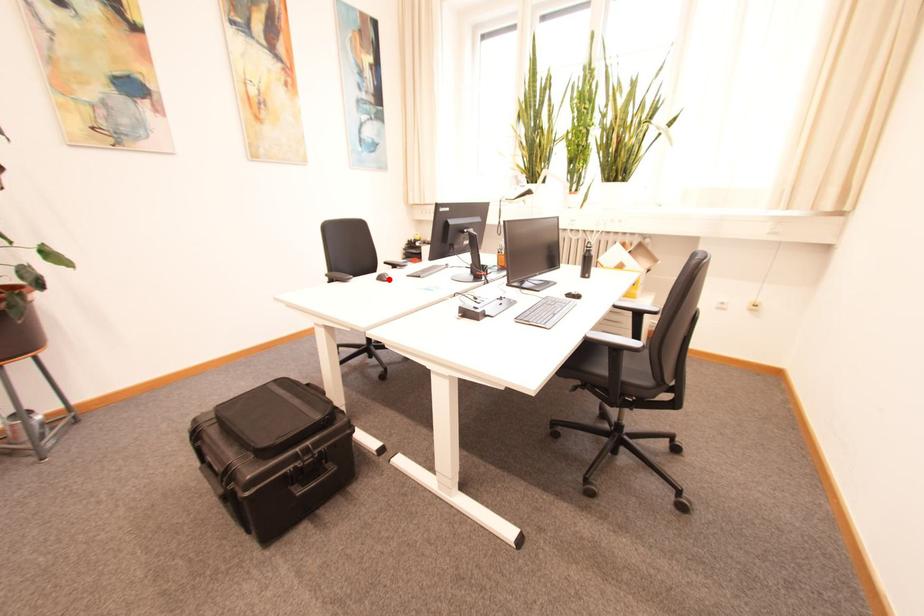
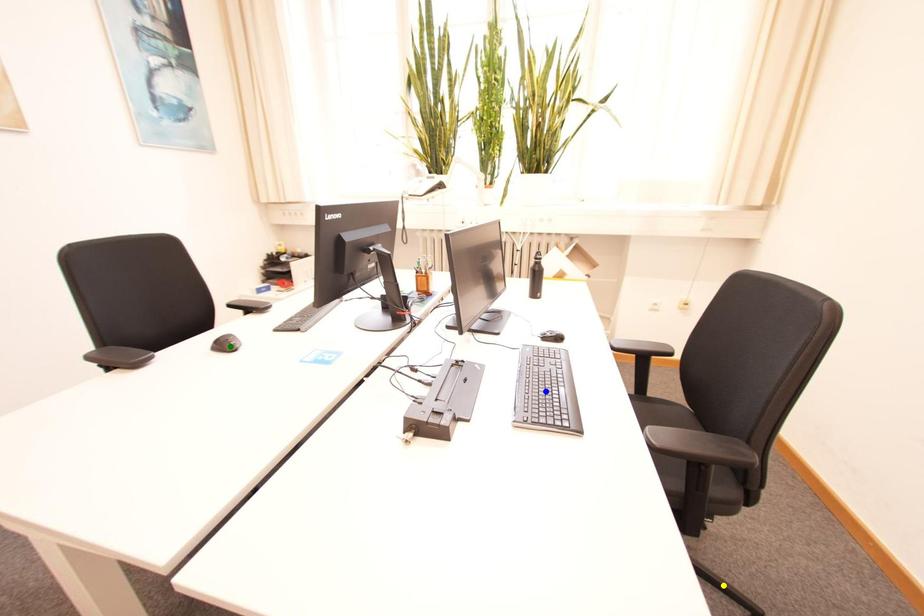
Question: I am providing you with two images of the same scene from different viewpoints. A red point is marked on the first image. You are given multiple points on the second image. Which point in image 2 represents the same 3d spot as the red point in image 1?

Choices:
 (A) green point
 (B) yellow point
 (C) blue point

Answer: (A)